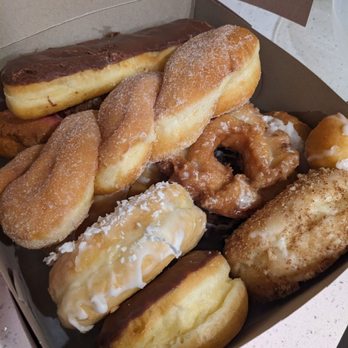
Locate an element on the screen. slight view of the top of the cardboard box is located at coordinates (280, 14).